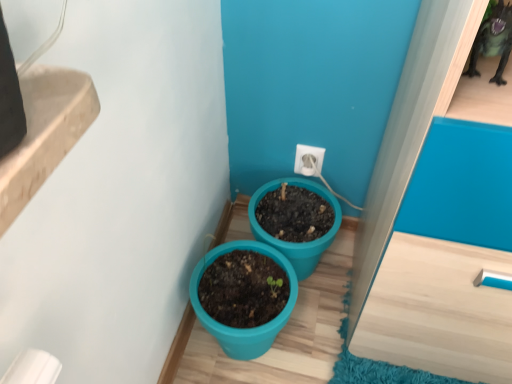
Question: Considering the relative positions of white plastic electric outlet at center and teal plastic pot at lower center, which is the second flowerpot in left-to-right order, in the image provided, is white plastic electric outlet at center behind teal plastic pot at lower center, which is the second flowerpot in left-to-right order,?

Choices:
 (A) yes
 (B) no

Answer: (A)

Question: Could you tell me if white plastic electric outlet at center is facing teal plastic pot at lower center, which is the second flowerpot in left-to-right order?

Choices:
 (A) no
 (B) yes

Answer: (A)

Question: Is white plastic electric outlet at center to the left of teal plastic pot at lower center, the first flowerpot when ordered from right to left, from the viewer's perspective?

Choices:
 (A) yes
 (B) no

Answer: (B)

Question: Does white plastic electric outlet at center have a larger size compared to teal plastic pot at lower center, which is the second flowerpot in left-to-right order?

Choices:
 (A) no
 (B) yes

Answer: (A)

Question: Would you say white plastic electric outlet at center is a long distance from teal plastic pot at lower center, which is the second flowerpot in left-to-right order?

Choices:
 (A) yes
 (B) no

Answer: (B)

Question: From a real-world perspective, is white plastic electric outlet at center located higher than teal plastic pot at lower center, the first flowerpot when ordered from right to left?

Choices:
 (A) no
 (B) yes

Answer: (B)

Question: Is teal plastic pot at lower center, which is the second flowerpot in left-to-right order, behind teal plastic pot at center, which appears as the 2th flowerpot when viewed from the right?

Choices:
 (A) yes
 (B) no

Answer: (A)

Question: Does teal plastic pot at lower center, which is the second flowerpot in left-to-right order, have a lesser height compared to teal plastic pot at center, which appears as the 2th flowerpot when viewed from the right?

Choices:
 (A) no
 (B) yes

Answer: (B)

Question: Considering the relative sizes of teal plastic pot at lower center, which is the second flowerpot in left-to-right order, and teal plastic pot at center, which appears as the 2th flowerpot when viewed from the right, in the image provided, is teal plastic pot at lower center, which is the second flowerpot in left-to-right order, taller than teal plastic pot at center, which appears as the 2th flowerpot when viewed from the right,?

Choices:
 (A) yes
 (B) no

Answer: (B)

Question: Is teal plastic pot at lower center, which is the second flowerpot in left-to-right order, oriented towards teal plastic pot at center, which appears as the 2th flowerpot when viewed from the right?

Choices:
 (A) yes
 (B) no

Answer: (A)

Question: Is teal plastic pot at lower center, which is the second flowerpot in left-to-right order, outside teal plastic pot at center, the 1th flowerpot in the left-to-right sequence?

Choices:
 (A) yes
 (B) no

Answer: (A)

Question: Is teal plastic pot at lower center, the first flowerpot when ordered from right to left, bigger than teal plastic pot at center, which appears as the 2th flowerpot when viewed from the right?

Choices:
 (A) yes
 (B) no

Answer: (B)

Question: Does teal plastic pot at center, which appears as the 2th flowerpot when viewed from the right, contain white plastic electric outlet at center?

Choices:
 (A) no
 (B) yes

Answer: (A)